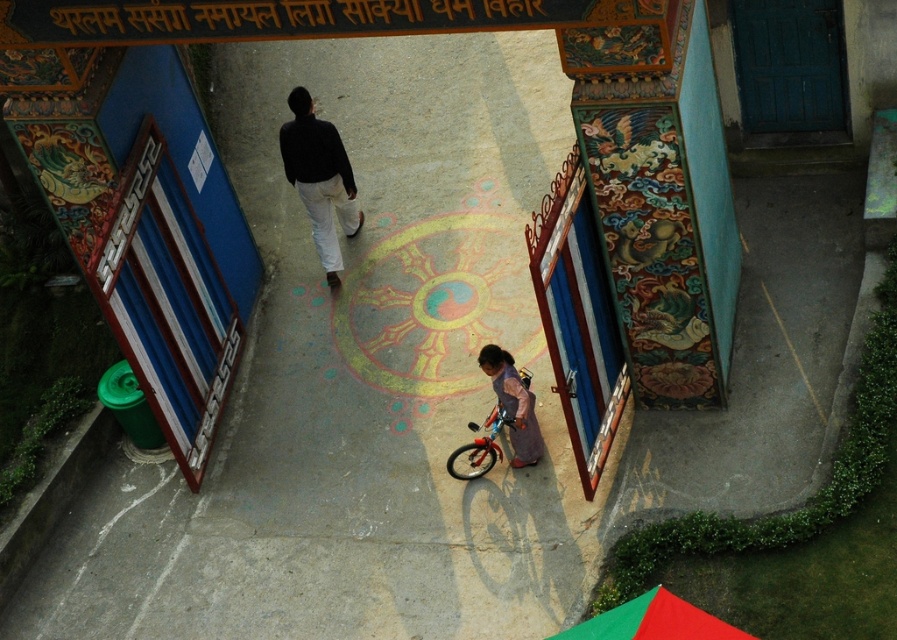
You are a GUI agent. You are given a task and a screenshot of the screen. Output one action in this format:
    pyautogui.click(x=<x>, y=<y>)
    Task: Click on the wooden door at center
    
    Given the screenshot: What is the action you would take?
    pyautogui.click(x=577, y=317)

Does wooden door at center have a lesser height compared to blue painted door at upper right?

No.

This screenshot has height=640, width=897. What do you see at coordinates (577, 317) in the screenshot? I see `wooden door at center` at bounding box center [577, 317].

Locate an element on the screen. wooden door at center is located at coordinates (577, 317).

Can you confirm if blue painted door at upper right is taller than black matte sweater at center?

No, blue painted door at upper right is not taller than black matte sweater at center.

Locate an element on the screen. The image size is (897, 640). blue painted door at upper right is located at coordinates (790, 72).

Is blue painted door at upper right wider than metallic silver bicycle at center?

Yes.

Who is shorter, blue painted door at upper right or metallic silver bicycle at center?

Standing shorter between the two is metallic silver bicycle at center.

Is point (832, 6) positioned behind point (499, 378)?

Yes, point (832, 6) is behind point (499, 378).

The image size is (897, 640). Identify the location of blue painted door at upper right. (790, 72).